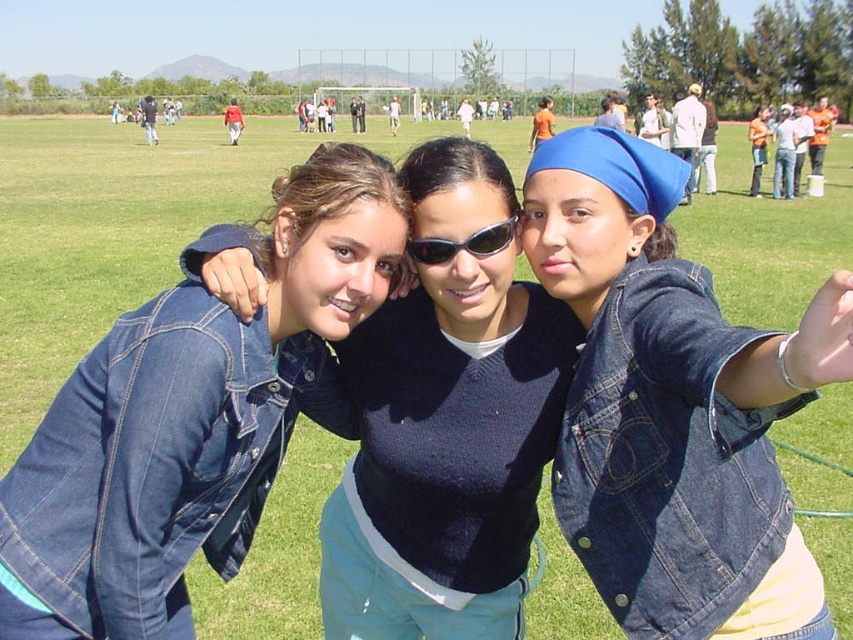
Question: Among these objects, which one is nearest to the camera?

Choices:
 (A) denim jacket at left
 (B) denim jacket at center
 (C) blue denim jacket at center

Answer: (C)

Question: In this image, where is blue denim jacket at center located relative to black plastic goggles at center?

Choices:
 (A) right
 (B) left

Answer: (A)

Question: Is denim jacket at left positioned before denim jacket at center?

Choices:
 (A) no
 (B) yes

Answer: (B)

Question: Which point is farther to the camera?

Choices:
 (A) (505, 221)
 (B) (521, 349)
 (C) (824, 620)
 (D) (167, 572)

Answer: (B)

Question: Is denim jacket at left wider than denim jacket at center?

Choices:
 (A) no
 (B) yes

Answer: (B)

Question: Among these points, which one is nearest to the camera?

Choices:
 (A) 418,253
 (B) 386,557
 (C) 598,364

Answer: (C)